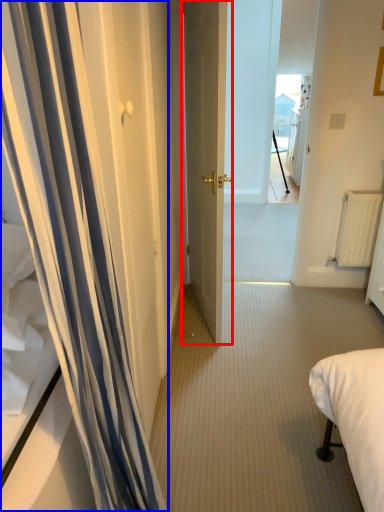
Question: Which object appears farthest to the camera in this image, door (highlighted by a red box) or curtain (highlighted by a blue box)?

Choices:
 (A) door
 (B) curtain

Answer: (A)